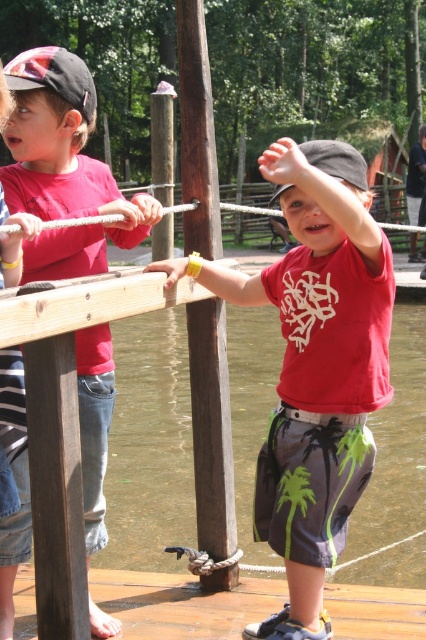
Question: Which point is farther from the camera taking this photo?

Choices:
 (A) (278, 353)
 (B) (354, 618)

Answer: (A)

Question: Does matte red t-shirt at center have a greater width compared to brown rough wood pole at center?

Choices:
 (A) no
 (B) yes

Answer: (A)

Question: Does brown water at lower center come in front of brown wood pole at center?

Choices:
 (A) yes
 (B) no

Answer: (A)

Question: Which is nearer to the brown rough wood pole at center?

Choices:
 (A) brown wood pole at center
 (B) matte red shirt at left
 (C) matte red t-shirt at center
 (D) wooden dock at lower center

Answer: (D)

Question: Which of the following is the farthest from the observer?

Choices:
 (A) (420, 620)
 (B) (224, 438)

Answer: (B)

Question: Where is brown wood pole at center located in relation to wooden dock at lower center in the image?

Choices:
 (A) below
 (B) above

Answer: (B)